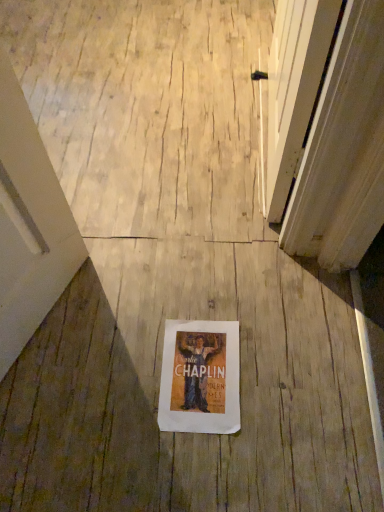
Where is `blank space above white paper poster at center (from a real-world perspective)`? This screenshot has width=384, height=512. blank space above white paper poster at center (from a real-world perspective) is located at coordinates (198, 372).